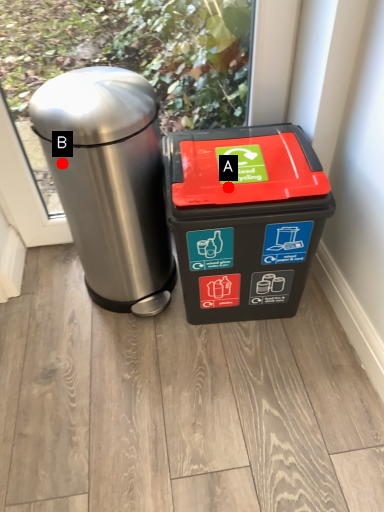
Question: Two points are circled on the image, labeled by A and B beside each circle. Which point is closer to the camera taking this photo?

Choices:
 (A) A is closer
 (B) B is closer

Answer: (A)